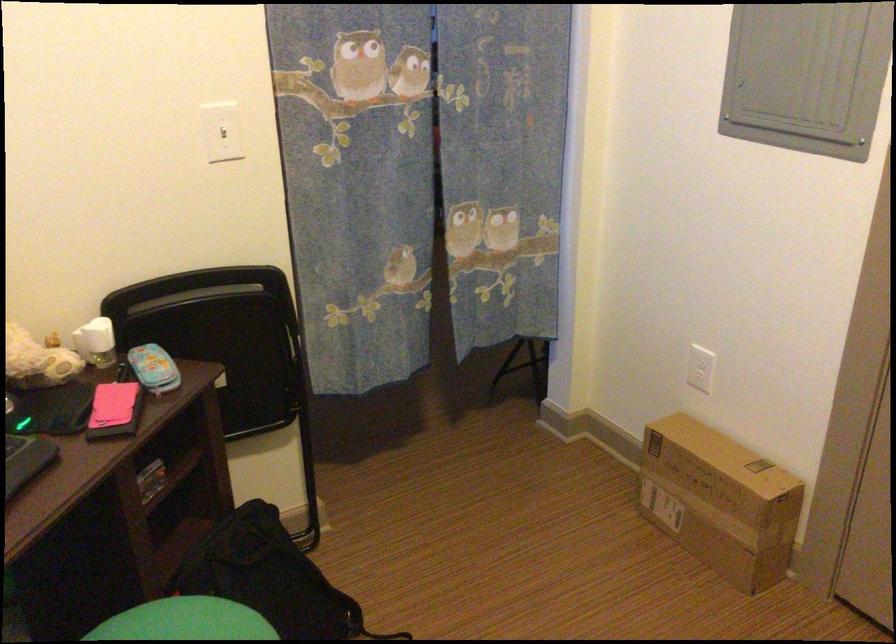
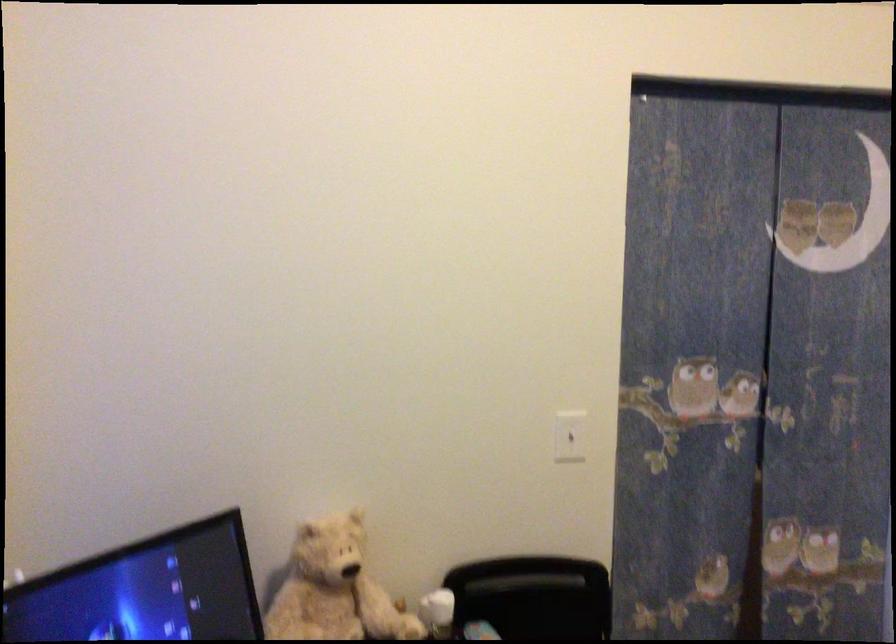
The point at (97,334) is marked in the first image. Where is the corresponding point in the second image?

(437, 612)